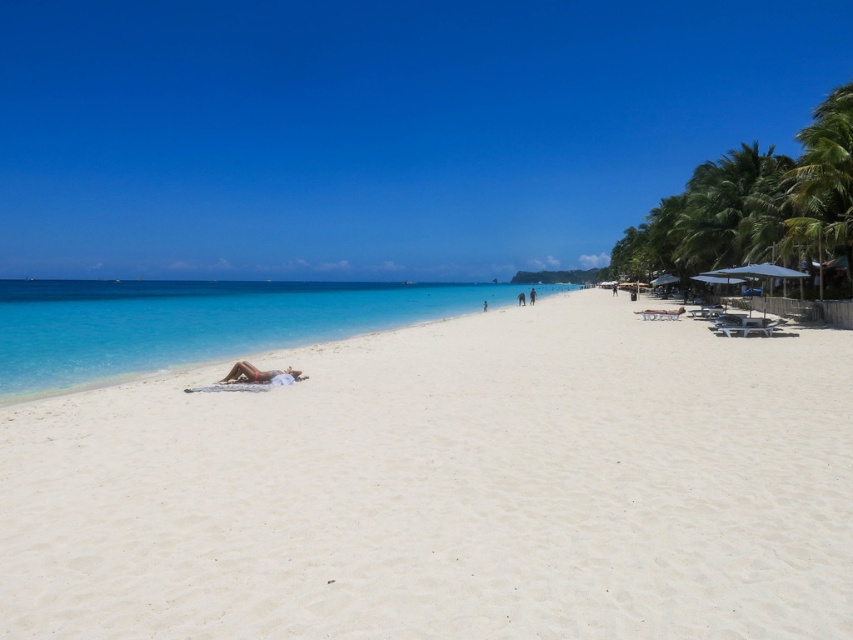
What do you see at coordinates (447, 490) in the screenshot? I see `white sandy beach at center` at bounding box center [447, 490].

This screenshot has width=853, height=640. What are the coordinates of `white sandy beach at center` in the screenshot? It's located at (447, 490).

Describe the element at coordinates (196, 323) in the screenshot. I see `clear blue water at center` at that location.

Which is more to the right, clear blue water at center or green leafy palm tree at upper right?

green leafy palm tree at upper right

Locate an element on the screen. Image resolution: width=853 pixels, height=640 pixels. clear blue water at center is located at coordinates (196, 323).

Who is higher up, clear blue water at center or tan skin person at center?

clear blue water at center

Identify the location of clear blue water at center. (196, 323).

Does point (224, 282) come behind point (257, 376)?

Yes, point (224, 282) is farther from viewer.

Locate an element on the screen. clear blue water at center is located at coordinates (196, 323).